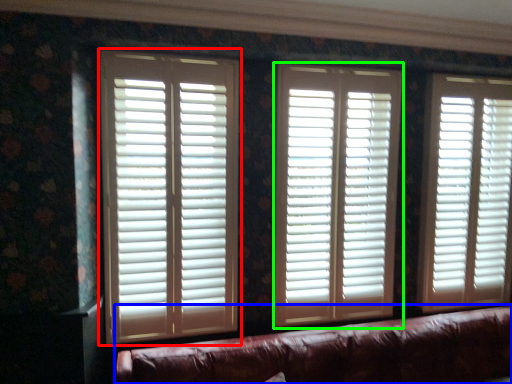
Question: Considering the real-world distances, which object is farthest from window blind (highlighted by a red box)? studio couch (highlighted by a blue box) or window blind (highlighted by a green box)?

Choices:
 (A) studio couch
 (B) window blind

Answer: (A)